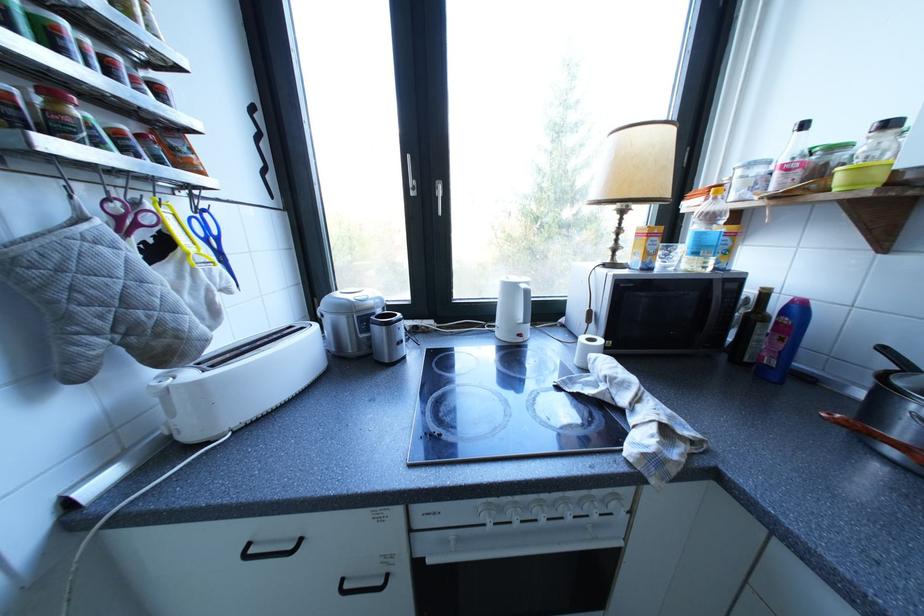
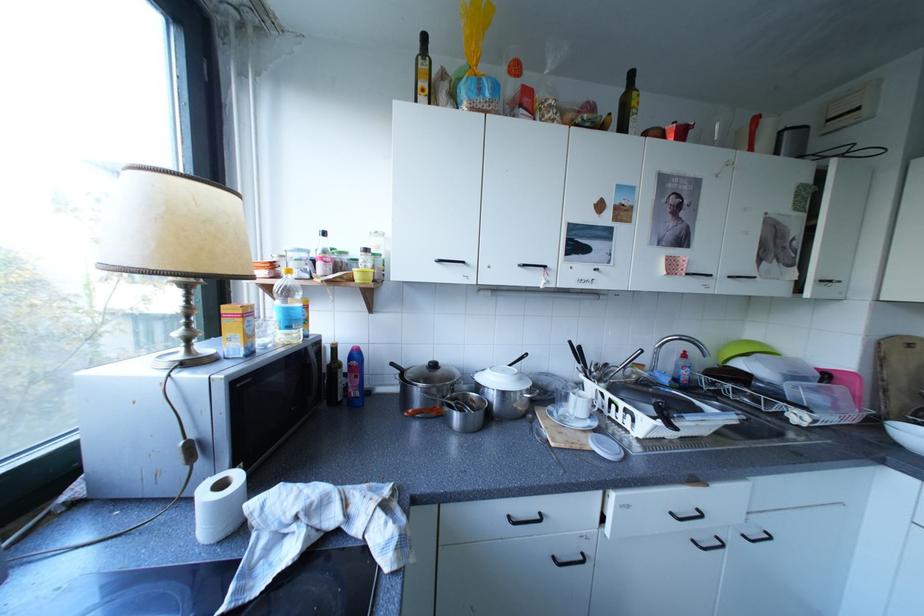
Question: The images are taken continuously from a first-person perspective. In which direction is your viewpoint rotating?

Choices:
 (A) Left
 (B) Right
 (C) Up
 (D) Down

Answer: (B)